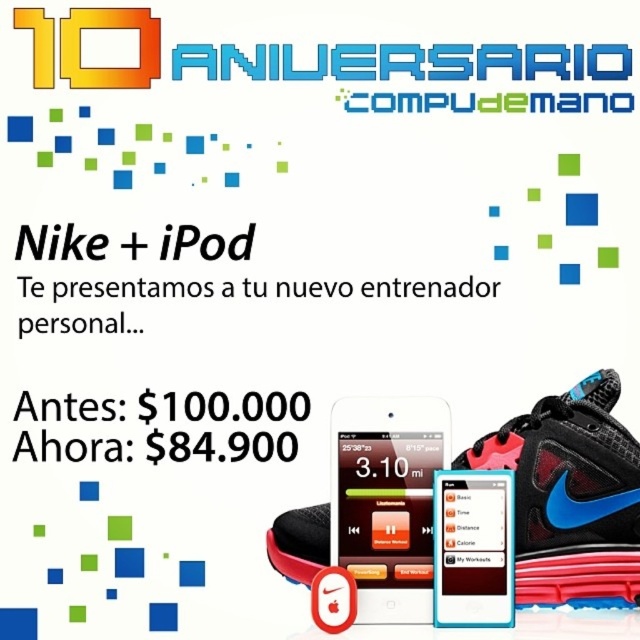
Who is lower down, satin black smartphone at center or matte white smartphone at center?

matte white smartphone at center is below.

Does satin black smartphone at center come behind matte white smartphone at center?

Yes.

Find the location of a particular element. The image size is (640, 640). satin black smartphone at center is located at coordinates (387, 500).

Locate an element on the screen. Image resolution: width=640 pixels, height=640 pixels. satin black smartphone at center is located at coordinates (387, 500).

I want to click on black mesh shoe at lower right, so pyautogui.click(x=570, y=497).

Is black mesh shoe at lower right shorter than matte white smartphone at center?

No.

Who is more forward, [276,554] or [460,600]?

Positioned in front is point [460,600].

The height and width of the screenshot is (640, 640). In order to click on black mesh shoe at lower right in this screenshot , I will do `click(570, 497)`.

Does black mesh shoe at lower right have a greater height compared to satin black smartphone at center?

Indeed, black mesh shoe at lower right has a greater height compared to satin black smartphone at center.

Between black mesh shoe at lower right and satin black smartphone at center, which one appears on the right side from the viewer's perspective?

black mesh shoe at lower right

Between point (525, 476) and point (339, 403), which one is positioned in front?

Point (525, 476)

This screenshot has width=640, height=640. I want to click on black mesh shoe at lower right, so click(570, 497).